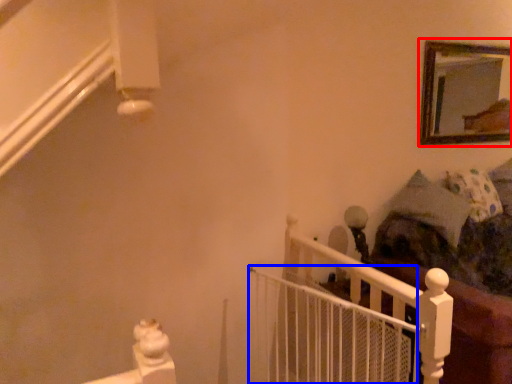
Question: Which object appears closest to the camera in this image, picture frame (highlighted by a red box) or balustrade (highlighted by a blue box)?

Choices:
 (A) picture frame
 (B) balustrade

Answer: (B)